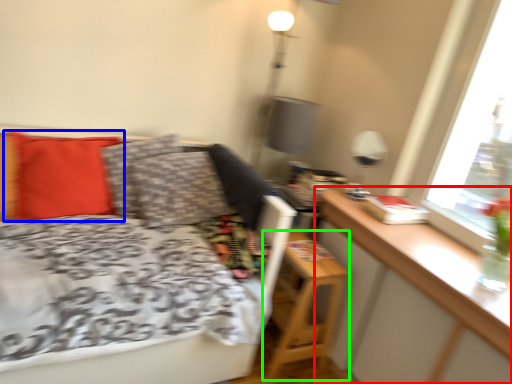
Question: Based on their relative distances, which object is nearer to table (highlighted by a red box)? Choose from pillow (highlighted by a blue box) and nightstand (highlighted by a green box).

Choices:
 (A) pillow
 (B) nightstand

Answer: (B)